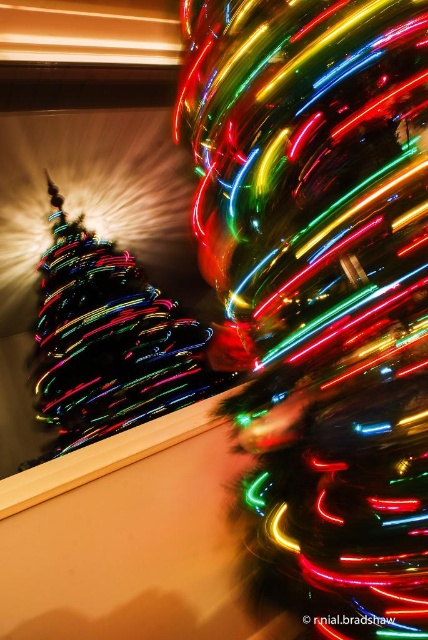
Question: Is multicolored neon lights at center to the right of multicolored lights at left from the viewer's perspective?

Choices:
 (A) yes
 (B) no

Answer: (A)

Question: Which point is closer to the camera?

Choices:
 (A) multicolored lights at left
 (B) multicolored neon lights at center

Answer: (B)

Question: Which point is closer to the camera?

Choices:
 (A) (246, 445)
 (B) (76, 369)

Answer: (A)

Question: Is multicolored neon lights at center smaller than multicolored lights at left?

Choices:
 (A) no
 (B) yes

Answer: (B)

Question: Can you confirm if multicolored neon lights at center is positioned to the left of multicolored lights at left?

Choices:
 (A) no
 (B) yes

Answer: (A)